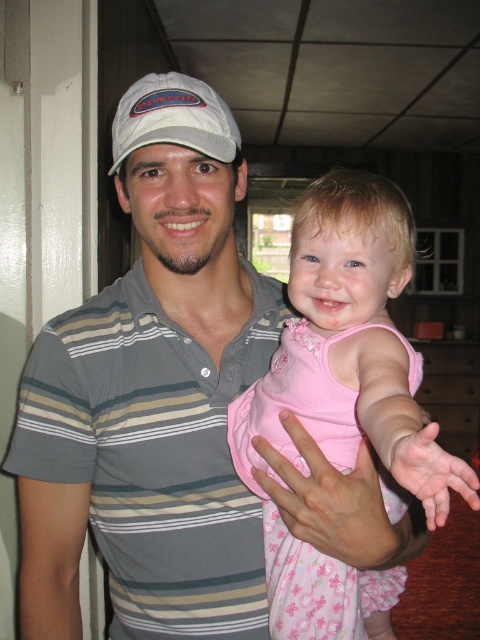
Question: Among these objects, which one is farthest from the camera?

Choices:
 (A) striped cotton polo shirt at center
 (B) white fabric baseball cap at upper center

Answer: (A)

Question: Is striped cotton polo shirt at center positioned before gray striped shirt at left?

Choices:
 (A) yes
 (B) no

Answer: (A)

Question: Which of the following is the farthest from the observer?

Choices:
 (A) (367, 340)
 (B) (109, 288)
 (C) (205, 131)

Answer: (B)

Question: Can you confirm if striped cotton polo shirt at center is positioned below pink satin dress at center?

Choices:
 (A) no
 (B) yes

Answer: (A)

Question: Which point appears closest to the camera in this image?

Choices:
 (A) (351, 589)
 (B) (189, 134)
 (C) (49, 564)

Answer: (B)

Question: In this image, where is pink satin dress at center located relative to white fabric baseball cap at upper center?

Choices:
 (A) below
 (B) above

Answer: (A)